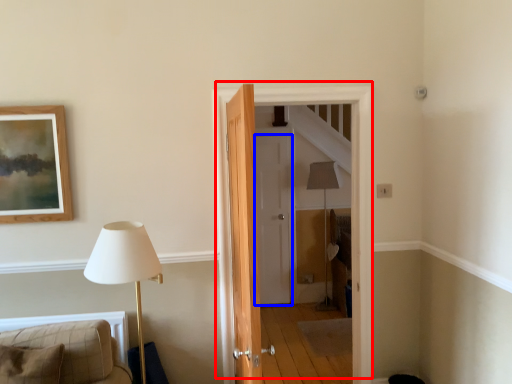
Question: Which object is further to the camera taking this photo, door (highlighted by a red box) or door (highlighted by a blue box)?

Choices:
 (A) door
 (B) door

Answer: (B)